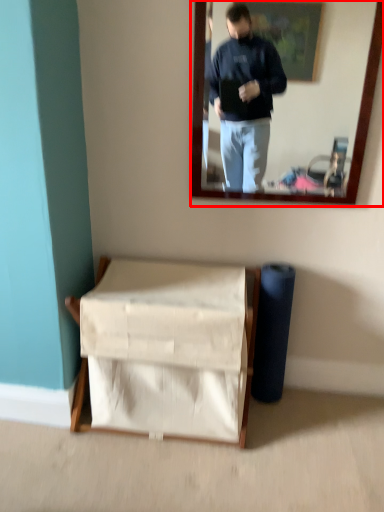
Question: From the image's perspective, what is the correct spatial relationship of mirror (annotated by the red box) in relation to furniture?

Choices:
 (A) above
 (B) below

Answer: (A)